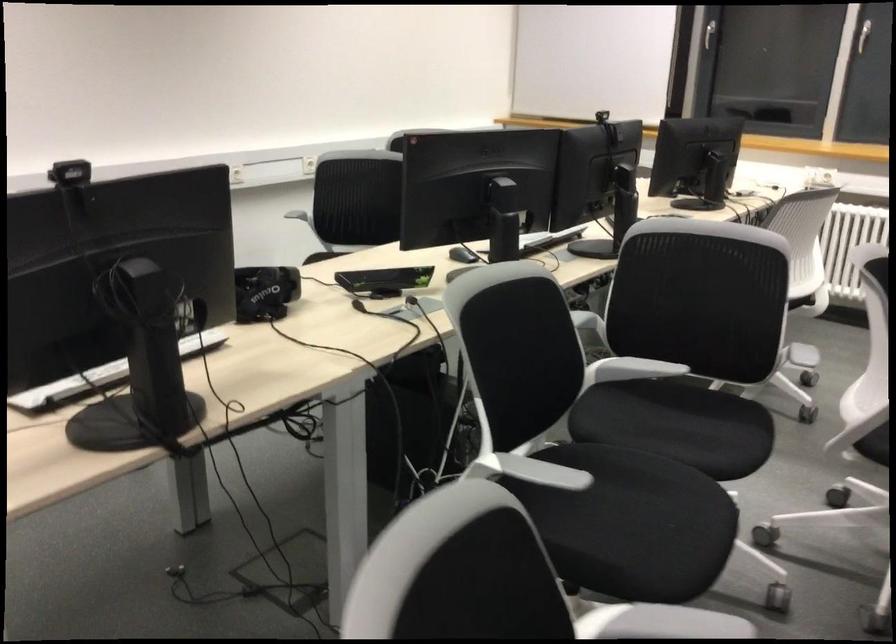
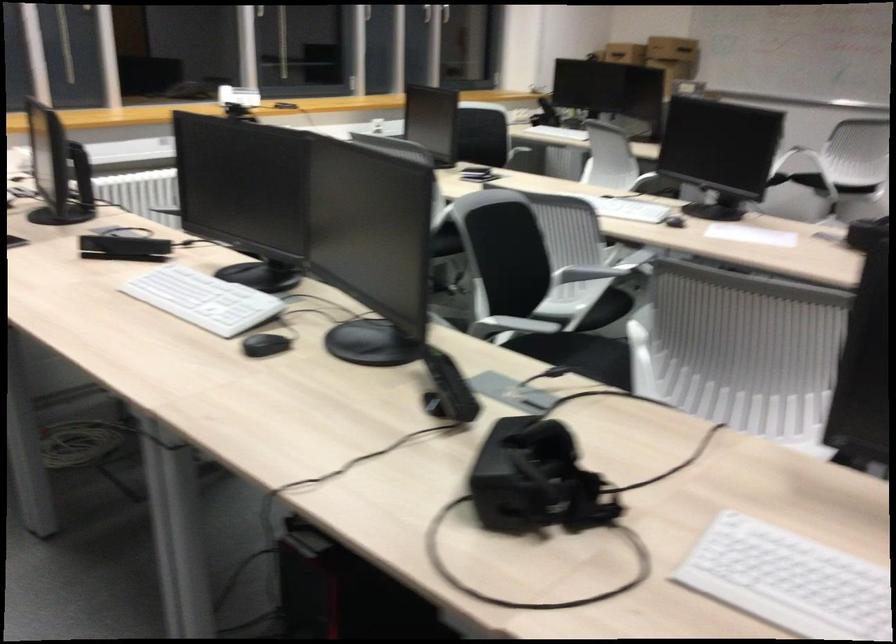
Question: I am providing you with two images of the same scene from different viewpoints. Please identify which objects are invisible in image2.

Choices:
 (A) white power outlet
 (B) black computer mouse
 (C) chair sitting surface
 (D) black VR headset

Answer: (C)